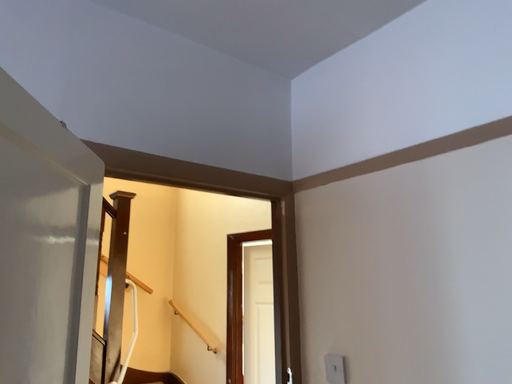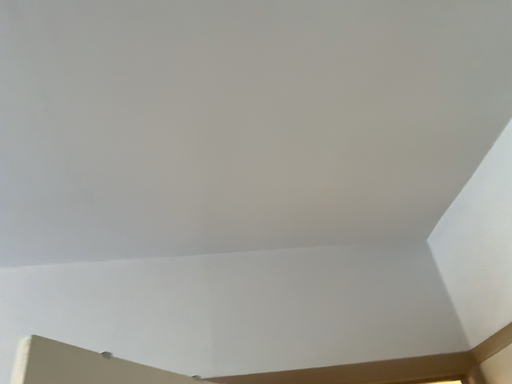
Question: Which way did the camera rotate in the video?

Choices:
 (A) rotated right
 (B) rotated left

Answer: (B)